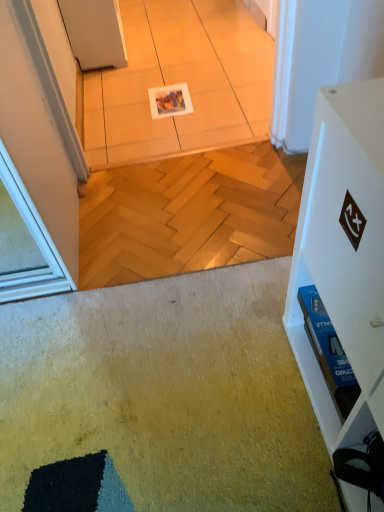
Question: Which is correct: white glossy tile at center is inside white matte cabinet at right, or outside of it?

Choices:
 (A) outside
 (B) inside

Answer: (A)

Question: From the image's perspective, relative to white matte cabinet at right, is white glossy tile at center above or below?

Choices:
 (A) above
 (B) below

Answer: (A)

Question: From their relative heights in the image, would you say white glossy tile at center is taller or shorter than white matte cabinet at right?

Choices:
 (A) tall
 (B) short

Answer: (B)

Question: Does point (334, 183) appear closer or farther from the camera than point (210, 96)?

Choices:
 (A) farther
 (B) closer

Answer: (B)

Question: From a real-world perspective, is white matte cabinet at right above or below white glossy tile at center?

Choices:
 (A) below
 (B) above

Answer: (B)

Question: Considering the positions of white matte cabinet at right and white glossy tile at center in the image, is white matte cabinet at right wider or thinner than white glossy tile at center?

Choices:
 (A) thin
 (B) wide

Answer: (A)

Question: Would you say white matte cabinet at right is to the left or to the right of white glossy tile at center in the picture?

Choices:
 (A) right
 (B) left

Answer: (A)